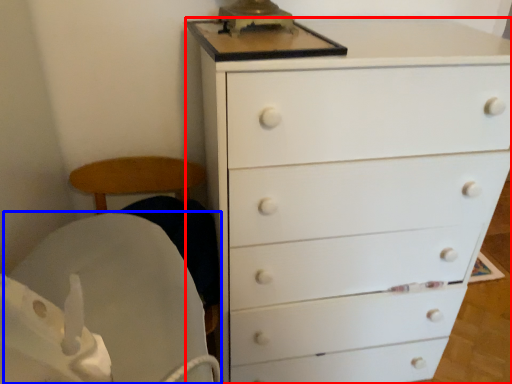
Question: Which object appears farthest to the camera in this image, chest of drawers (highlighted by a red box) or rocking chair (highlighted by a blue box)?

Choices:
 (A) chest of drawers
 (B) rocking chair

Answer: (B)